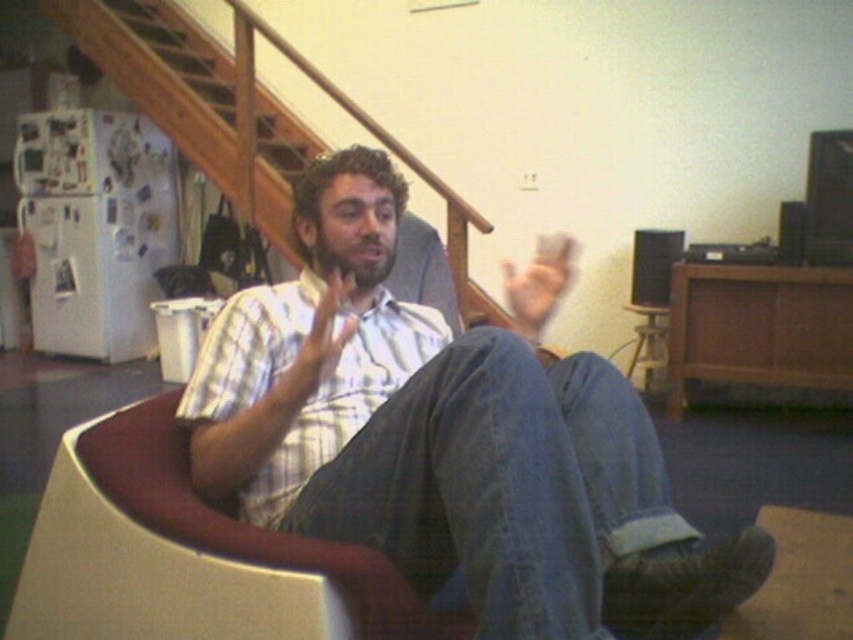
Question: Does plaid shirt at center lie behind white plastic swivel chair at center?

Choices:
 (A) yes
 (B) no

Answer: (B)

Question: Which object is farther from the camera taking this photo?

Choices:
 (A) white plastic swivel chair at center
 (B) plaid shirt at center

Answer: (A)

Question: Which point is farther from the camera taking this photo?

Choices:
 (A) (413, 596)
 (B) (328, 424)

Answer: (B)

Question: Can you confirm if plaid shirt at center is positioned to the right of white plastic swivel chair at center?

Choices:
 (A) no
 (B) yes

Answer: (B)

Question: Does plaid shirt at center lie in front of white plastic swivel chair at center?

Choices:
 (A) yes
 (B) no

Answer: (A)